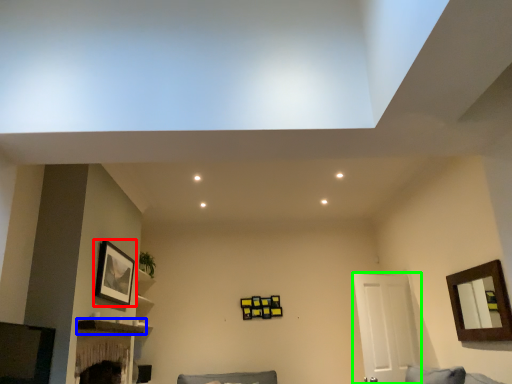
Question: Based on their relative distances, which object is nearer to picture frame (highlighted by a red box)? Choose from shelf (highlighted by a blue box) and door (highlighted by a green box).

Choices:
 (A) shelf
 (B) door

Answer: (A)